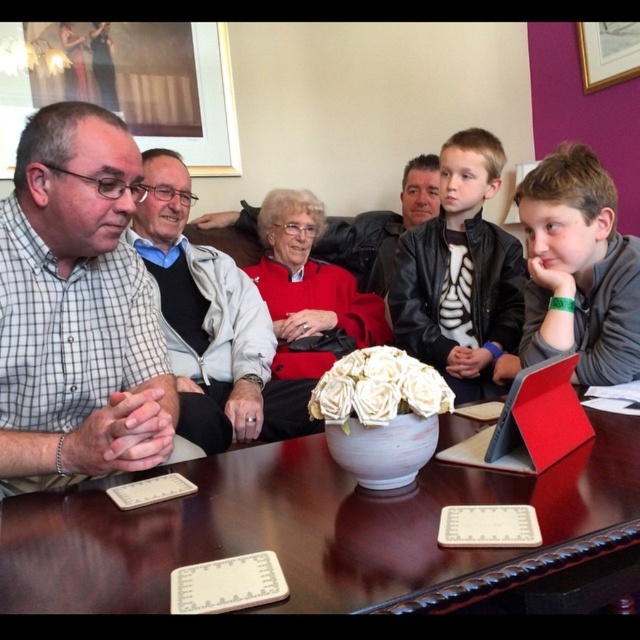
You are a guest at this gathering and want to borrow the matte black laptop at center from the person wearing the checkered fabric shirt at left. Can you reach it without moving from your current position?

The matte black laptop at center is further to the viewer than the checkered fabric shirt at left, so you can reach it without needing to move closer since it is already closer to you.

You are standing 1 meter away from the table in the scene. Can you reach the point at coordinates point [96,188] on the table surface?

The distance of point [96,188] from viewer is 1.05 meters, so you are standing 1 meter away from the table. Since the point is only 0.05 meters further away, you can easily reach it.

Based on the scene description, where is the matte black laptop at center located in terms of coordinates?

The matte black laptop at center is located at coordinates point (77, 308).